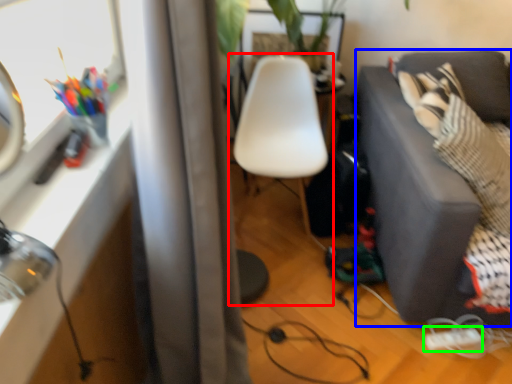
Question: Estimate the real-world distances between objects in this image. Which object is closer to chair (highlighted by a red box), studio couch (highlighted by a blue box) or extension cord (highlighted by a green box)?

Choices:
 (A) studio couch
 (B) extension cord

Answer: (A)